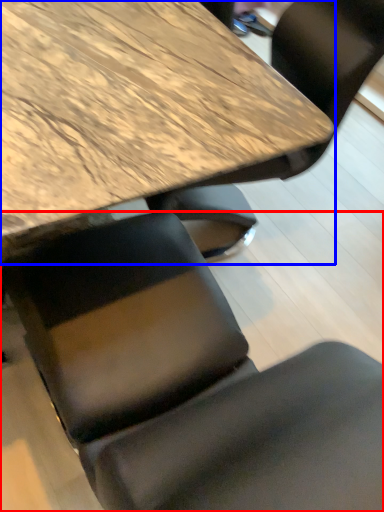
Question: Which object appears farthest to the camera in this image, chair (highlighted by a red box) or table (highlighted by a blue box)?

Choices:
 (A) chair
 (B) table

Answer: (B)